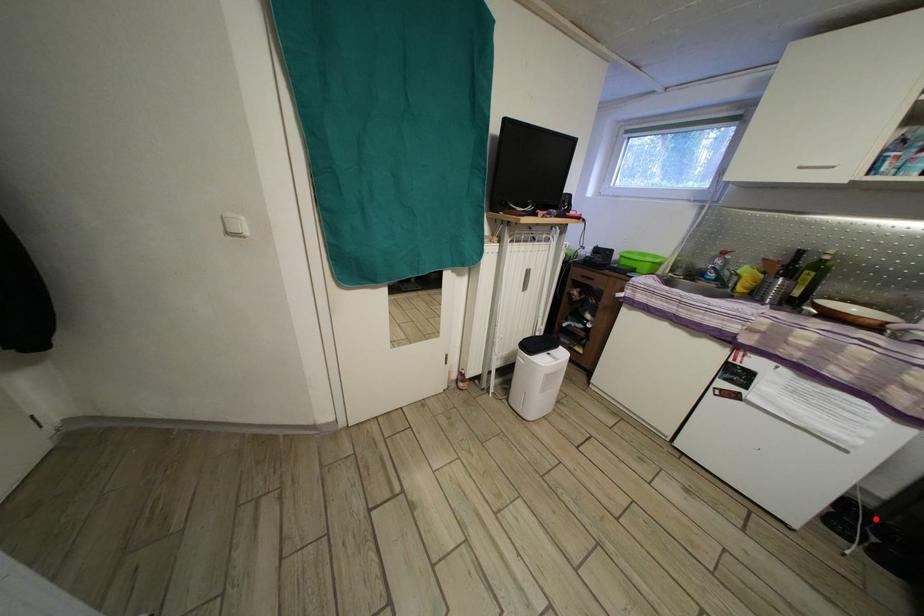
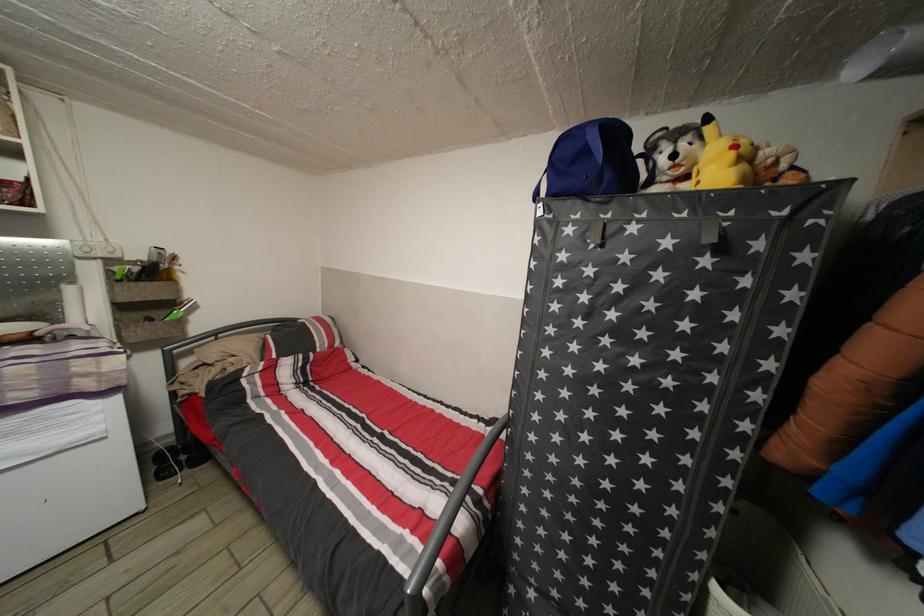
The point at the highlighted location is marked in the first image. Where is the corresponding point in the second image?

(177, 455)